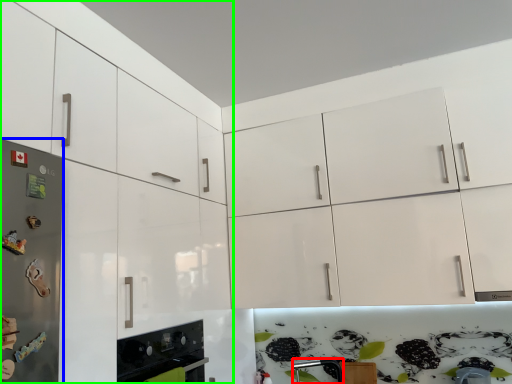
Question: Based on their relative distances, which object is farther from silver (highlighted by a red box)? Choose from fridge (highlighted by a blue box) and cabinetry (highlighted by a green box).

Choices:
 (A) fridge
 (B) cabinetry

Answer: (A)